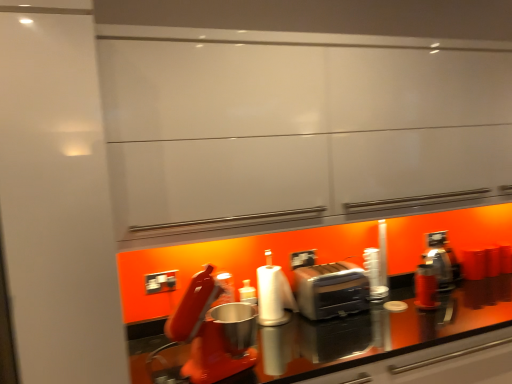
The height and width of the screenshot is (384, 512). What do you see at coordinates (273, 296) in the screenshot?
I see `white matte paper towel at center` at bounding box center [273, 296].

In order to face white matte paper towel at center, should I rotate leftwards or rightwards?

To face it directly, rotate right by 2.900 degrees.

You are a GUI agent. You are given a task and a screenshot of the screen. Output one action in this format:
    pyautogui.click(x=<x>, y=<y>)
    Task: Click on the white matte paper towel at center
    
    Given the screenshot: What is the action you would take?
    pyautogui.click(x=273, y=296)

In the scene shown: Measure the distance between point (x=343, y=261) and camera.

2.22 meters.

What is the approximate width of satin silver toaster at center?

It is 9.80 inches.

What do you see at coordinates (331, 290) in the screenshot?
I see `satin silver toaster at center` at bounding box center [331, 290].

Image resolution: width=512 pixels, height=384 pixels. In order to click on satin silver toaster at center in this screenshot , I will do `click(331, 290)`.

Measure the distance between satin silver toaster at center and camera.

satin silver toaster at center is 1.94 meters away from camera.

You are a GUI agent. You are given a task and a screenshot of the screen. Output one action in this format:
    pyautogui.click(x=<x>, y=<y>)
    Task: Click on the white matte paper towel at center
    The height and width of the screenshot is (384, 512).
    Given the screenshot: What is the action you would take?
    pyautogui.click(x=273, y=296)

Considering the relative positions of white matte paper towel at center and satin silver toaster at center in the image provided, is white matte paper towel at center to the left of satin silver toaster at center from the viewer's perspective?

Yes.

Which is behind, white matte paper towel at center or satin silver toaster at center?

Positioned behind is satin silver toaster at center.

Does point (287, 304) lie behind point (350, 280)?

No, (287, 304) is in front of (350, 280).

From the image's perspective, relative to satin silver toaster at center, is white matte paper towel at center above or below?

From the image's perspective, white matte paper towel at center appears above satin silver toaster at center.

Based on the photo, from a real-world perspective, between white matte paper towel at center and satin silver toaster at center, who is vertically higher?

white matte paper towel at center.

Can you confirm if white matte paper towel at center is wider than satin silver toaster at center?

Incorrect, the width of white matte paper towel at center does not surpass that of satin silver toaster at center.

Considering the relative sizes of white matte paper towel at center and satin silver toaster at center in the image provided, is white matte paper towel at center taller than satin silver toaster at center?

Yes.

Is white matte paper towel at center smaller than satin silver toaster at center?

Yes, white matte paper towel at center is smaller than satin silver toaster at center.

Is satin silver toaster at center completely or partially inside white matte paper towel at center?

No, white matte paper towel at center does not contain satin silver toaster at center.

Is white matte paper towel at center next to satin silver toaster at center?

No, white matte paper towel at center is not in contact with satin silver toaster at center.

Is white matte paper towel at center aimed at satin silver toaster at center?

No, white matte paper towel at center is not turned towards satin silver toaster at center.

From the picture: How many degrees apart are the facing directions of white matte paper towel at center and satin silver toaster at center?

The facing directions of white matte paper towel at center and satin silver toaster at center are 1.32 degrees apart.

Locate an element on the screen. toaster on the right of the white matte paper towel at center is located at coordinates (331, 290).

In the image, is satin silver toaster at center on the left side or the right side of white matte paper towel at center?

In the image, satin silver toaster at center appears on the right side of white matte paper towel at center.

In the image, is satin silver toaster at center positioned in front of or behind white matte paper towel at center?

satin silver toaster at center is behind white matte paper towel at center.

Which is less distant, (x=322, y=274) or (x=278, y=281)?

Positioned in front is point (x=278, y=281).

From the image's perspective, is satin silver toaster at center under white matte paper towel at center?

Correct, satin silver toaster at center appears lower than white matte paper towel at center in the image.

From a real-world perspective, which object stands above the other?

In real-world perspective, white matte paper towel at center is above.

Can you confirm if satin silver toaster at center is thinner than white matte paper towel at center?

No, satin silver toaster at center is not thinner than white matte paper towel at center.

Considering the sizes of satin silver toaster at center and white matte paper towel at center in the image, is satin silver toaster at center taller or shorter than white matte paper towel at center?

Considering their sizes, satin silver toaster at center has less height than white matte paper towel at center.

Considering the sizes of objects satin silver toaster at center and white matte paper towel at center in the image provided, who is bigger, satin silver toaster at center or white matte paper towel at center?

satin silver toaster at center is bigger.

In the scene shown: Does satin silver toaster at center contain white matte paper towel at center?

No, white matte paper towel at center is not surrounded by satin silver toaster at center.

Is satin silver toaster at center with white matte paper towel at center?

No, satin silver toaster at center is not touching white matte paper towel at center.

Is satin silver toaster at center positioned with its back to white matte paper towel at center?

That's not correct — satin silver toaster at center is not looking away from white matte paper towel at center.

What's the angular difference between satin silver toaster at center and white matte paper towel at center's facing directions?

There is a 1.32-degree angle between the facing directions of satin silver toaster at center and white matte paper towel at center.

Image resolution: width=512 pixels, height=384 pixels. Find the location of `toaster to the right of white matte paper towel at center`. toaster to the right of white matte paper towel at center is located at coordinates (331, 290).

The image size is (512, 384). I want to click on paper towel in front of the satin silver toaster at center, so click(273, 296).

Locate an element on the screen. toaster behind the white matte paper towel at center is located at coordinates pyautogui.click(x=331, y=290).